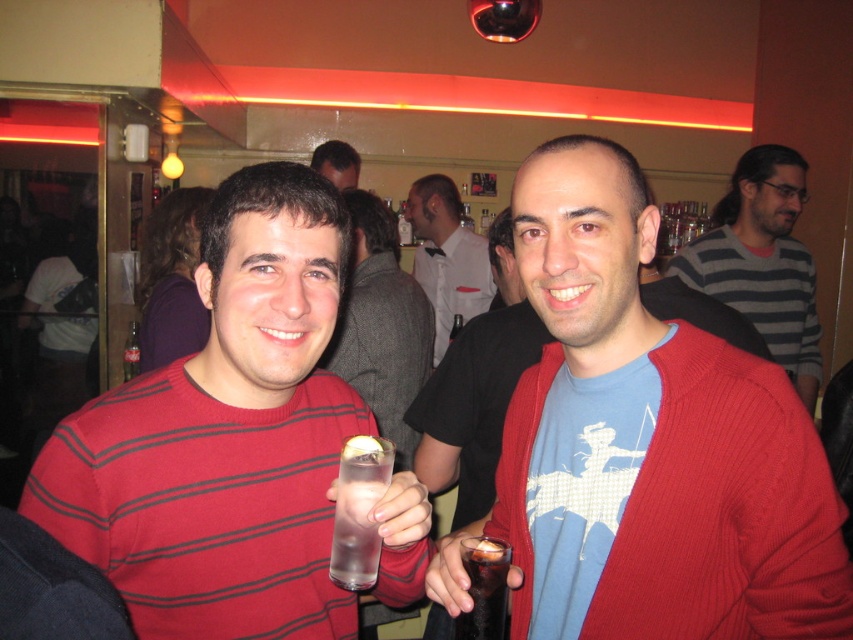
You are standing in the bar area and want to reach the point marked at coordinates point (x=503, y=620). Considering the space between you and the point, can you walk directly to it without needing to move around any obstacles?

The point (x=503, y=620) is 3.64 feet away from viewer, so yes, you can walk directly to it without needing to move around any obstacles since there is enough space.

You are a photographer standing in the center of the room. You notice two black clothing items in the scene. The first is a matte black sweater at center, and the second is a matte black shirt at center. Which of these items is positioned lower in the image?

The matte black sweater at center is located below the matte black shirt at center, so it is positioned lower in the image.

You are a bartender at the bar. You need to place a new drink order between the matte black sweater at center and the matte black shirt at center. Which side of the larger item should the drink be placed?

The matte black sweater at center is larger than the matte black shirt at center. The drink should be placed on the side of the matte black sweater at center.